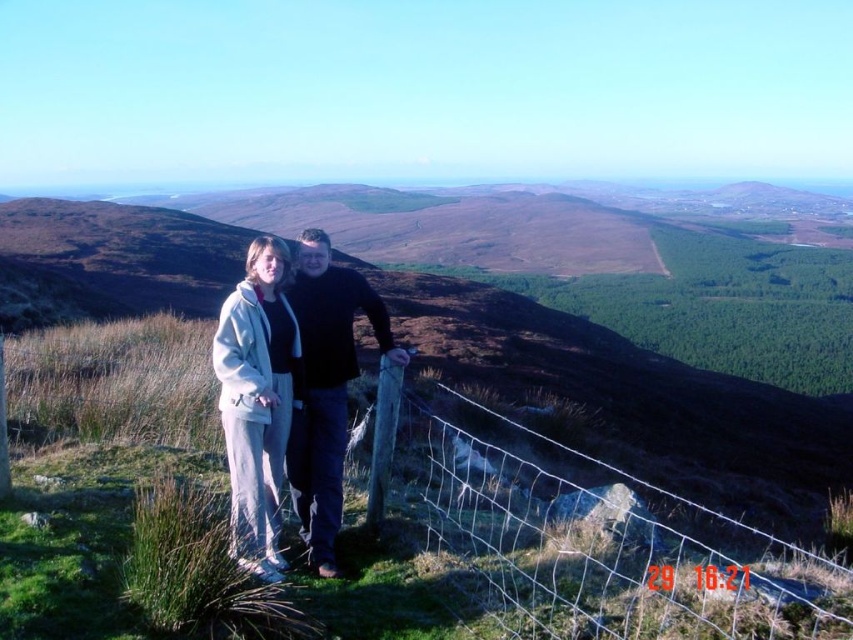
You are a photographer standing 2 meters away from the two people in the image. You want to take a photo that includes both the white fleece jacket at center and the black matte jacket at center without any cropping. What is the minimum width of your camera lens in meters to capture both subjects?

The distance between the white fleece jacket at center and the black matte jacket at center is 1.03 meters. To capture both subjects without cropping, the camera lens must be at least 1.03 meters wide.

You are a photographer trying to capture a wide shot of the two people in the scene. Given that the wire mesh fence at center and the white fleece jacket at center are both in the frame, can you fit both objects entirely within the camera frame without cropping either one?

The wire mesh fence at center is wider than the white fleece jacket at center. Since the fence is wider, you need to ensure the camera frame is wide enough to accommodate the fence. If the camera can capture the entire width of the fence, then the jacket will also fit as it is narrower.